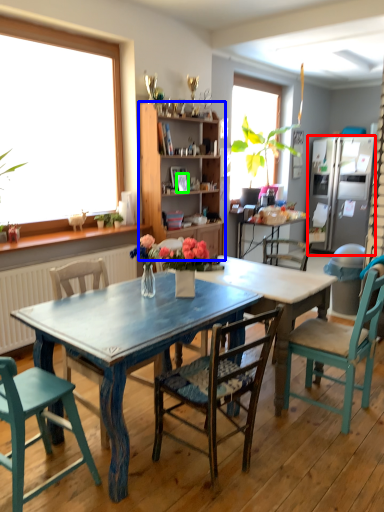
Question: Estimate the real-world distances between objects in this image. Which object is farther from refrigerator (highlighted by a red box), cabinetry (highlighted by a blue box) or picture frame (highlighted by a green box)?

Choices:
 (A) cabinetry
 (B) picture frame

Answer: (B)